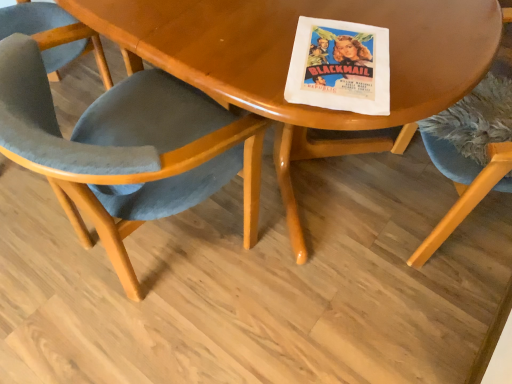
Question: Could velvet blue chair at right, marked as the first chair in a right-to-left arrangement, be considered to be inside velvet blue chair at center, acting as the first chair starting from the left?

Choices:
 (A) yes
 (B) no

Answer: (B)

Question: Is velvet blue chair at center, acting as the 2th chair starting from the right, taller than velvet blue chair at right, the second chair from the left?

Choices:
 (A) no
 (B) yes

Answer: (A)

Question: Is velvet blue chair at center, acting as the first chair starting from the left, further to the viewer compared to velvet blue chair at right, marked as the first chair in a right-to-left arrangement?

Choices:
 (A) no
 (B) yes

Answer: (A)

Question: From a real-world perspective, does velvet blue chair at center, acting as the first chair starting from the left, sit lower than velvet blue chair at right, marked as the first chair in a right-to-left arrangement?

Choices:
 (A) no
 (B) yes

Answer: (B)

Question: Is velvet blue chair at right, marked as the first chair in a right-to-left arrangement, at the back of velvet blue chair at center, acting as the 2th chair starting from the right?

Choices:
 (A) no
 (B) yes

Answer: (A)

Question: Could you tell me if velvet blue chair at center, acting as the 2th chair starting from the right, is turned towards velvet blue chair at right, the second chair from the left?

Choices:
 (A) no
 (B) yes

Answer: (A)

Question: Can you confirm if velvet blue chair at center, acting as the first chair starting from the left, is positioned to the left of wooden table at center?

Choices:
 (A) no
 (B) yes

Answer: (B)

Question: Is velvet blue chair at center, acting as the first chair starting from the left, with wooden table at center?

Choices:
 (A) yes
 (B) no

Answer: (B)

Question: From a real-world perspective, does velvet blue chair at center, acting as the first chair starting from the left, stand above wooden table at center?

Choices:
 (A) no
 (B) yes

Answer: (B)

Question: Could you tell me if velvet blue chair at center, acting as the first chair starting from the left, is turned towards wooden table at center?

Choices:
 (A) yes
 (B) no

Answer: (B)

Question: Is velvet blue chair at center, acting as the 2th chair starting from the right, oriented away from wooden table at center?

Choices:
 (A) yes
 (B) no

Answer: (B)

Question: Does wooden table at center have a lesser width compared to velvet blue chair at right, marked as the first chair in a right-to-left arrangement?

Choices:
 (A) no
 (B) yes

Answer: (A)